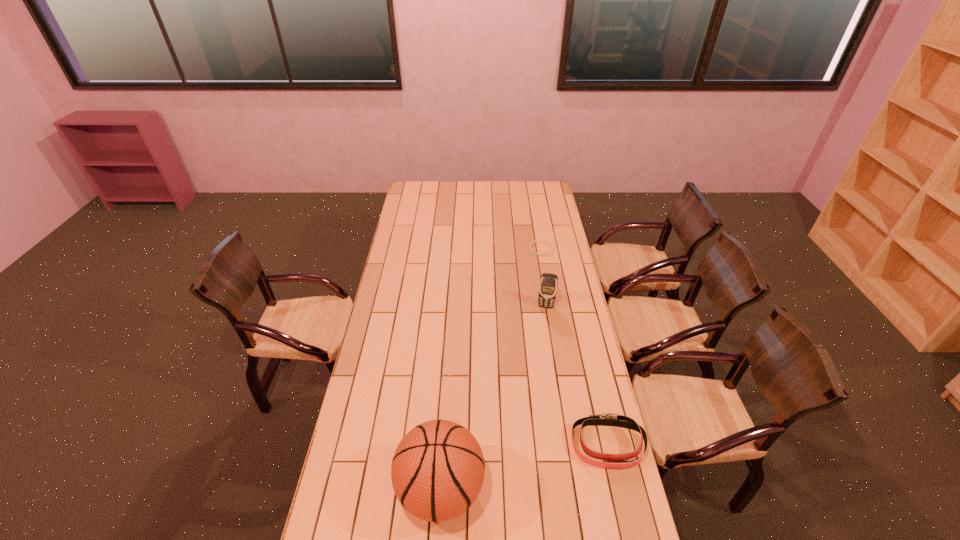
You are a GUI agent. You are given a task and a screenshot of the screen. Output one action in this format:
    pyautogui.click(x=<x>, y=<y>)
    Task: Click on the cellular telephone that is at the right edge
    
    Given the screenshot: What is the action you would take?
    pyautogui.click(x=548, y=285)

You are a GUI agent. You are given a task and a screenshot of the screen. Output one action in this format:
    pyautogui.click(x=<x>, y=<y>)
    Task: Click on the vacant space at the far edge of the desktop
    
    Given the screenshot: What is the action you would take?
    pyautogui.click(x=463, y=190)

Find the location of a particular element. This screenshot has height=540, width=960. free location at the left edge is located at coordinates (423, 214).

Identify the location of vacant space at the right edge. The height and width of the screenshot is (540, 960). point(567,410).

Locate an element on the screen. This screenshot has height=540, width=960. vacant space at the far left corner of the desktop is located at coordinates (412, 187).

Locate an element on the screen. Image resolution: width=960 pixels, height=540 pixels. free spot between the tallest object and the bracelet is located at coordinates (492, 369).

The image size is (960, 540). Identify the location of free space between the dog collar and the cellular telephone. (577, 375).

Identify the location of vacant space that's between the second farthest object and the tallest object. (493, 398).

The image size is (960, 540). I want to click on free space between the leftmost object and the shortest object, so click(492, 369).

Locate an element on the screen. The height and width of the screenshot is (540, 960). free spot between the tallest object and the bracelet is located at coordinates (492, 369).